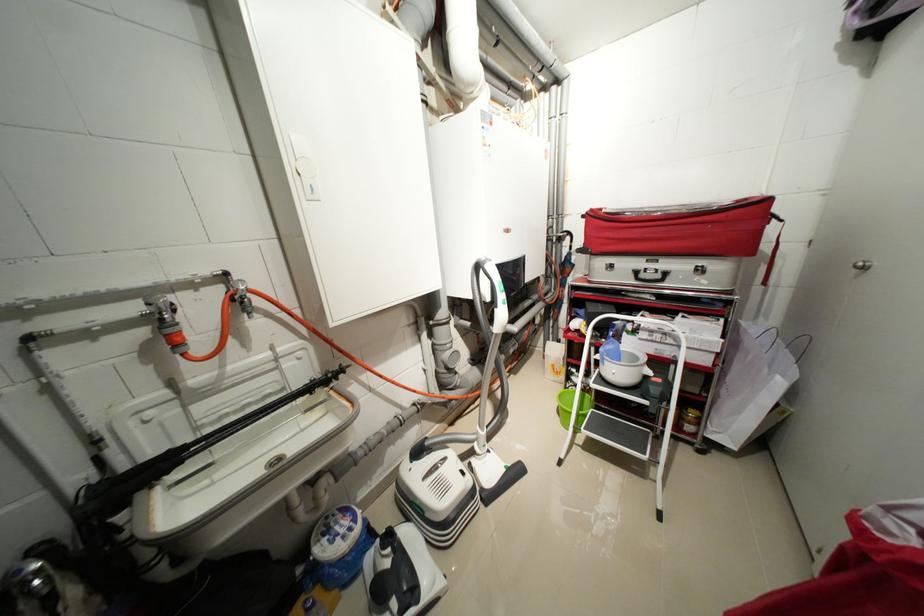
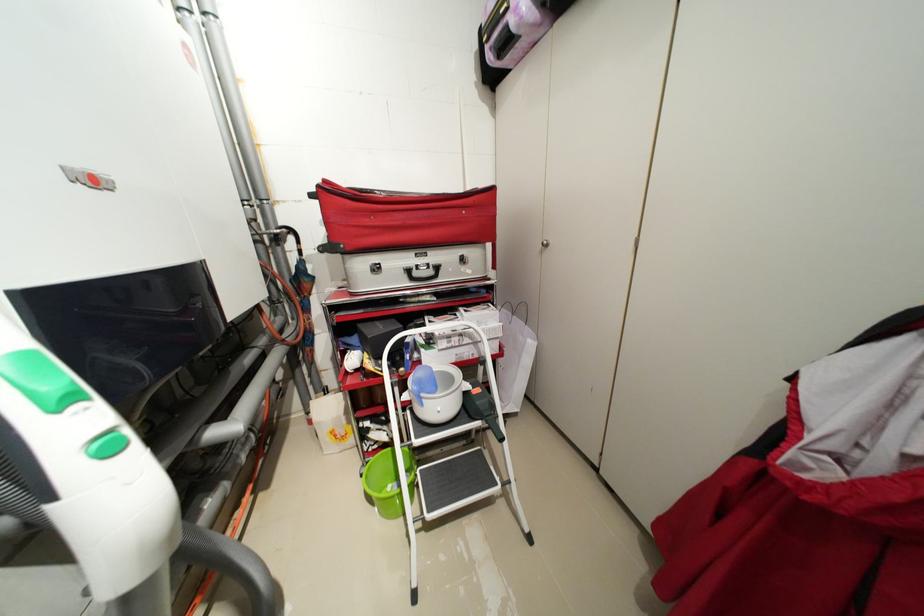
Where in the second image is the point corresponding to point (566, 397) from the first image?

(373, 479)